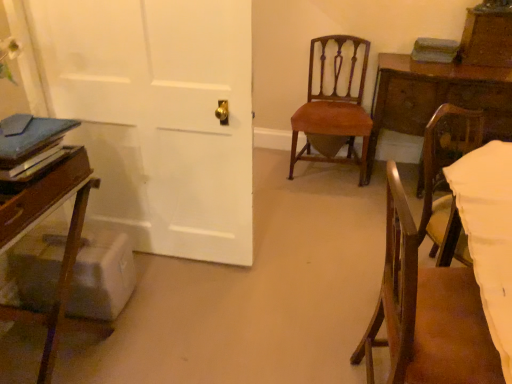
Question: From a real-world perspective, is wooden chair at lower right, marked as the 1th chair in a front-to-back arrangement, over velvet orange chair at center, which ranks as the second chair in left-to-right order?

Choices:
 (A) no
 (B) yes

Answer: (B)

Question: Does wooden chair at lower right, marked as the 1th chair in a front-to-back arrangement, appear on the right side of velvet orange chair at center, the first chair when ordered from back to front?

Choices:
 (A) yes
 (B) no

Answer: (A)

Question: Can you confirm if wooden chair at lower right, marked as the third chair in a left-to-right arrangement, is positioned to the left of velvet orange chair at center, which ranks as the second chair in left-to-right order?

Choices:
 (A) no
 (B) yes

Answer: (A)

Question: Is wooden chair at lower right, which is the first chair in right-to-left order, touching velvet orange chair at center, positioned as the 2th chair in right-to-left order?

Choices:
 (A) no
 (B) yes

Answer: (A)

Question: Considering the relative sizes of wooden chair at lower right, the 3th chair viewed from the back, and velvet orange chair at center, positioned as the 2th chair in right-to-left order, in the image provided, is wooden chair at lower right, the 3th chair viewed from the back, shorter than velvet orange chair at center, positioned as the 2th chair in right-to-left order,?

Choices:
 (A) yes
 (B) no

Answer: (B)

Question: Visually, is wooden chair at lower right, marked as the 1th chair in a front-to-back arrangement, positioned to the left or to the right of wooden table at right?

Choices:
 (A) right
 (B) left

Answer: (B)

Question: From a real-world perspective, is wooden chair at lower right, the 3th chair viewed from the back, above or below wooden table at right?

Choices:
 (A) below
 (B) above

Answer: (B)

Question: Considering their positions, is wooden chair at lower right, marked as the third chair in a left-to-right arrangement, located in front of or behind wooden table at right?

Choices:
 (A) front
 (B) behind

Answer: (A)

Question: Looking at their shapes, would you say wooden chair at lower right, marked as the 1th chair in a front-to-back arrangement, is wider or thinner than wooden table at right?

Choices:
 (A) wide
 (B) thin

Answer: (B)

Question: Considering the positions of wooden chair at left, positioned as the second chair in back-to-front order, and wooden table at right in the image, is wooden chair at left, positioned as the second chair in back-to-front order, taller or shorter than wooden table at right?

Choices:
 (A) short
 (B) tall

Answer: (B)

Question: Is point (29, 210) closer or farther from the camera than point (378, 114)?

Choices:
 (A) closer
 (B) farther

Answer: (A)

Question: In the image, is wooden chair at left, the second chair in the front-to-back sequence, on the left side or the right side of wooden table at right?

Choices:
 (A) left
 (B) right

Answer: (A)

Question: Looking at their shapes, would you say wooden chair at left, which is the 1th chair from left to right, is wider or thinner than wooden table at right?

Choices:
 (A) wide
 (B) thin

Answer: (B)

Question: From a real-world perspective, is wooden chair at left, which is the 1th chair from left to right, above or below wooden chair at lower right, which is the first chair in right-to-left order?

Choices:
 (A) below
 (B) above

Answer: (A)

Question: Is point (70, 266) closer or farther from the camera than point (433, 326)?

Choices:
 (A) closer
 (B) farther

Answer: (B)